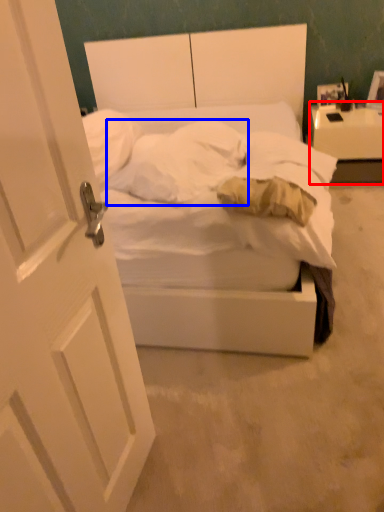
Question: Which of the following is the farthest to the observer, nightstand (highlighted by a red box) or pillow (highlighted by a blue box)?

Choices:
 (A) nightstand
 (B) pillow

Answer: (A)